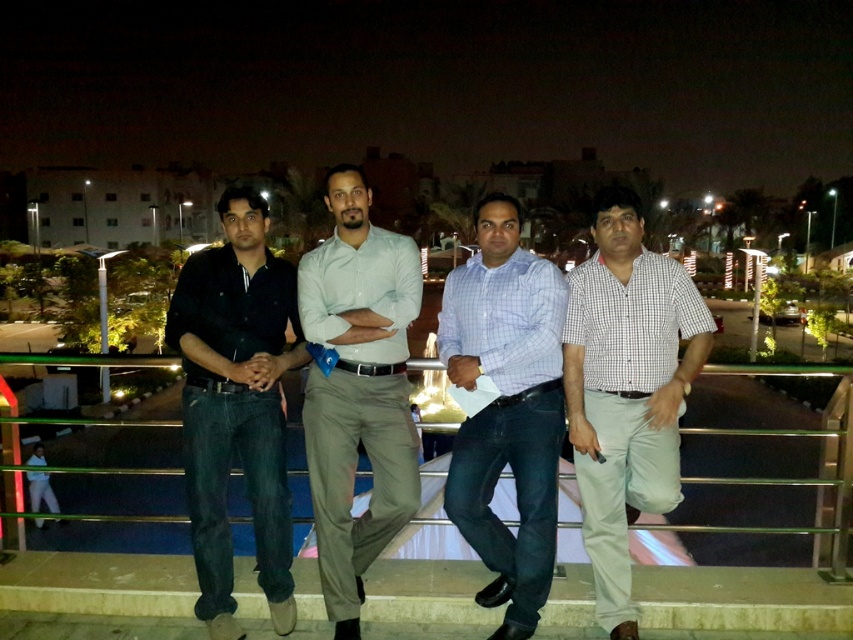
Question: Which object is the closest to the light gray cotton pants at center?

Choices:
 (A) dark blue denim jeans at left
 (B) light blue checkered shirt at center

Answer: (A)

Question: Which of the following is the farthest from the observer?

Choices:
 (A) checkered fabric shirt at right
 (B) light blue checkered shirt at center
 (C) light gray cotton pants at center
 (D) dark blue denim jeans at left

Answer: (C)

Question: Estimate the real-world distances between objects in this image. Which object is closer to the dark blue denim jeans at left?

Choices:
 (A) light gray cotton pants at center
 (B) light blue checkered shirt at center
 (C) checkered fabric shirt at right

Answer: (A)

Question: Is dark blue denim jeans at left behind light blue checkered shirt at center?

Choices:
 (A) yes
 (B) no

Answer: (B)

Question: Does light gray cotton pants at center appear on the left side of light blue checkered shirt at center?

Choices:
 (A) yes
 (B) no

Answer: (A)

Question: Can you confirm if dark blue denim jeans at left is smaller than checkered fabric shirt at right?

Choices:
 (A) yes
 (B) no

Answer: (A)